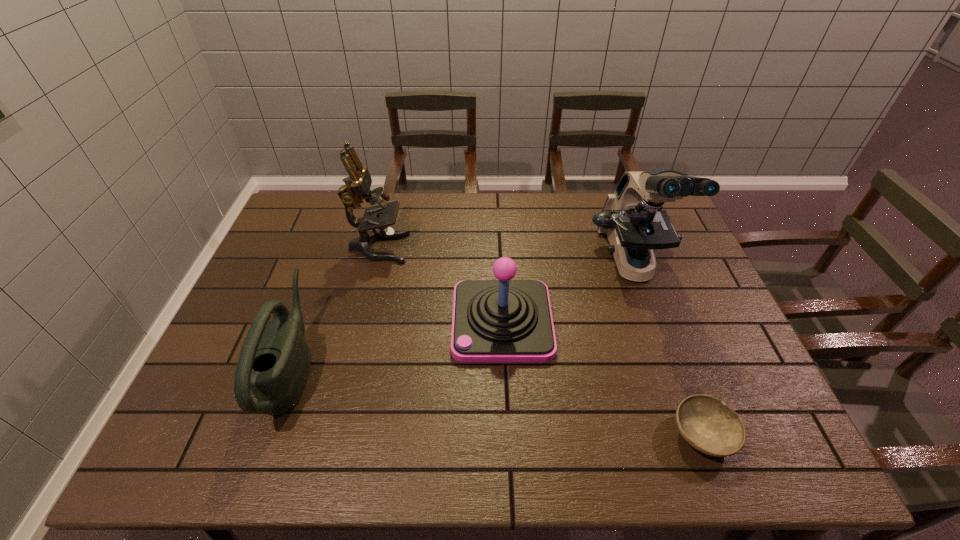
Find the location of a particular element. The image size is (960, 540). vacant area between the shortest object and the right microscope is located at coordinates (667, 349).

Locate an element on the screen. The image size is (960, 540). vacant area that lies between the left microscope and the right microscope is located at coordinates (505, 256).

Point out which object is positioned as the third nearest to the watering can. Please provide its 2D coordinates. Your answer should be formatted as a tuple, i.e. [(x, y)], where the tuple contains the x and y coordinates of a point satisfying the conditions above.

[(633, 219)]

In order to click on object that is the second closest to the right microscope in this screenshot , I will do `click(710, 426)`.

What are the coordinates of `vacant space that satisfies the following two spatial constraints: 1. on the back side of the shortest object; 2. on the spout of the watering can` in the screenshot? It's located at (678, 367).

Where is `free point that satisfies the following two spatial constraints: 1. forward from the base of the shortest object; 2. on the left side of the joystick`? The height and width of the screenshot is (540, 960). free point that satisfies the following two spatial constraints: 1. forward from the base of the shortest object; 2. on the left side of the joystick is located at coordinates (507, 434).

This screenshot has height=540, width=960. Find the location of `blank area in the image that satisfies the following two spatial constraints: 1. at the eyepieces of the left microscope; 2. on the back side of the bowl`. blank area in the image that satisfies the following two spatial constraints: 1. at the eyepieces of the left microscope; 2. on the back side of the bowl is located at coordinates (333, 434).

Where is `vacant space that satisfies the following two spatial constraints: 1. forward from the base of the joystick; 2. on the back side of the bowl`? The height and width of the screenshot is (540, 960). vacant space that satisfies the following two spatial constraints: 1. forward from the base of the joystick; 2. on the back side of the bowl is located at coordinates (507, 434).

This screenshot has height=540, width=960. Identify the location of free space that satisfies the following two spatial constraints: 1. through the eyepieces of the right microscope; 2. on the right side of the shortest object. (692, 434).

Identify the location of free region that satisfies the following two spatial constraints: 1. on the spout of the shortest object; 2. on the left side of the watering can. The image size is (960, 540). click(270, 434).